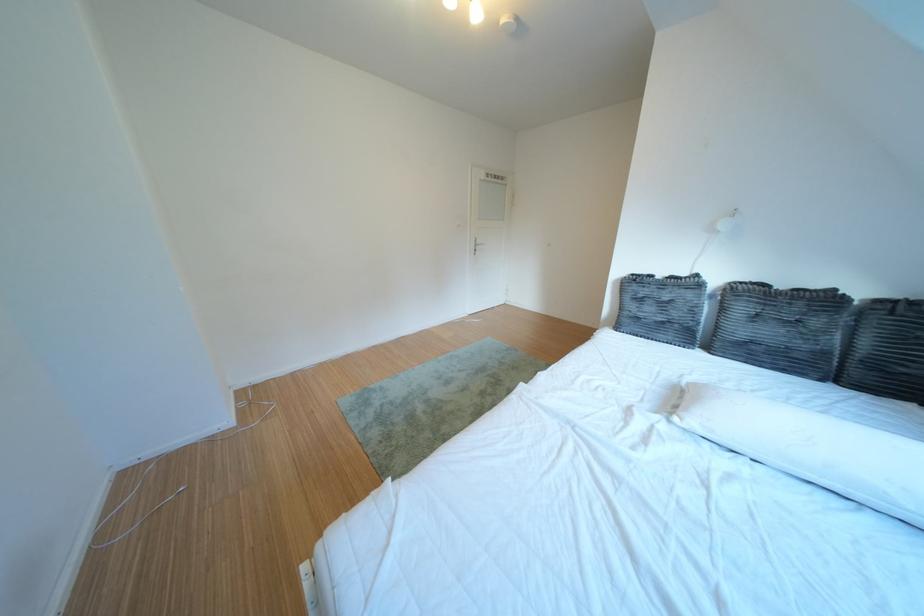
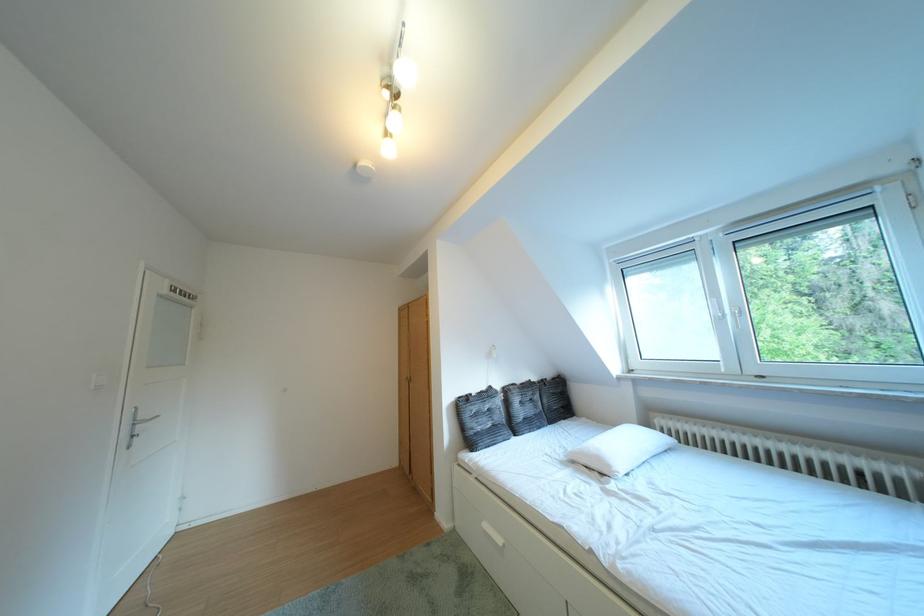
Find the pixel in the second image that matches point (639, 318) in the first image.

(484, 438)